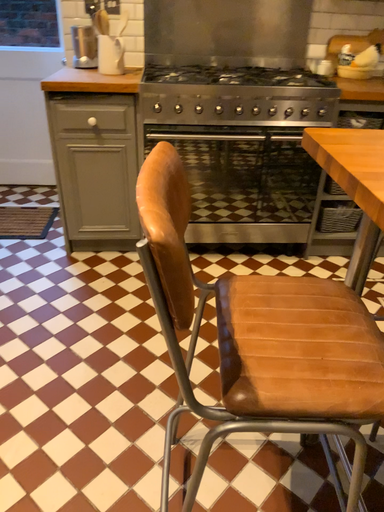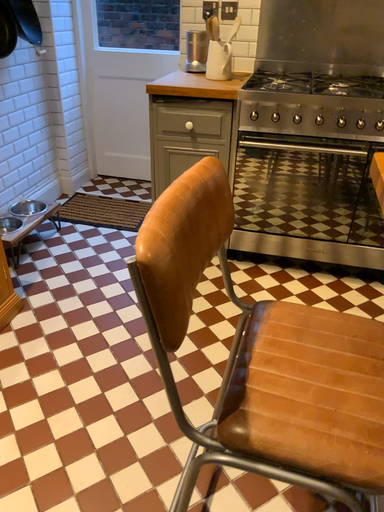
Question: How did the camera likely rotate when shooting the video?

Choices:
 (A) rotated left
 (B) rotated right

Answer: (A)